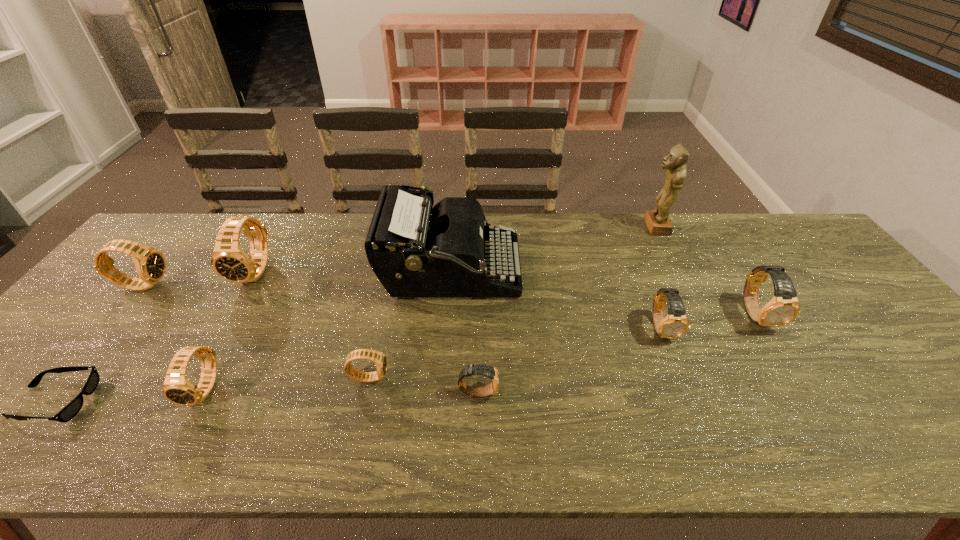
Find the location of a particular element. Image resolution: width=960 pixels, height=540 pixels. free space located on the face of the tallest watch is located at coordinates (231, 317).

The image size is (960, 540). I want to click on free space located 0.270m on the face of the third smallest black watch, so click(263, 285).

Identify the location of vacant area situated 0.160m on the face of the rightmost object. click(804, 390).

You are a GUI agent. You are given a task and a screenshot of the screen. Output one action in this format:
    pyautogui.click(x=<x>, y=<y>)
    Task: Click on the vacant space located 0.070m on the face of the third biggest black watch
    The image size is (960, 540).
    Given the screenshot: What is the action you would take?
    pyautogui.click(x=178, y=443)

This screenshot has height=540, width=960. I want to click on free spot located 0.140m on the face of the second smallest gold watch, so click(x=688, y=394).

Locate an element on the screen. This screenshot has width=960, height=540. free region located on the face of the nearest gold watch is located at coordinates (546, 392).

At what (x,y) coordinates should I click in order to perform the action: click on free space located 0.330m on the face of the smallest black watch. Please return your answer as a coordinate pair (x, y). The image size is (960, 540). Looking at the image, I should click on (528, 377).

Identify the location of figurine that is positioned at the far edge. (657, 221).

Find the location of a particular element. typewriter located at the far edge is located at coordinates (413, 254).

I want to click on watch that is at the far edge, so click(229, 260).